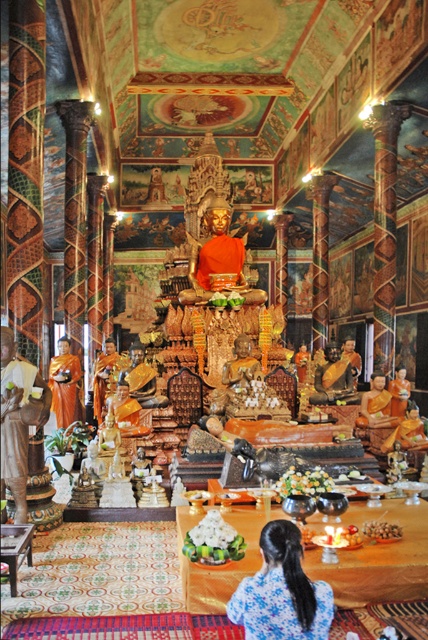
You are a tour guide leading a group through the temple. You want to point out both the gold metallic statue at left and the orange fabric robe at center to your visitors. Can you walk between them without needing to move any objects? Explain your reasoning.

The gold metallic statue at left and the orange fabric robe at center are 11.62 feet apart from each other, so there is sufficient space for you to walk between them without needing to move any objects.

You are an interior designer planning to place a new decorative item in the temple. You have a small sculpture that is 30 cm wide. There is space next to the gold metallic statue at left and the orange fabric robe at center. Which object should you place it next to if you want it to fit comfortably without overcrowding?

The gold metallic statue at left has a smaller width than the orange fabric robe at center, so placing the 30 cm wide sculpture next to the gold metallic statue at left would provide more space and prevent overcrowding.